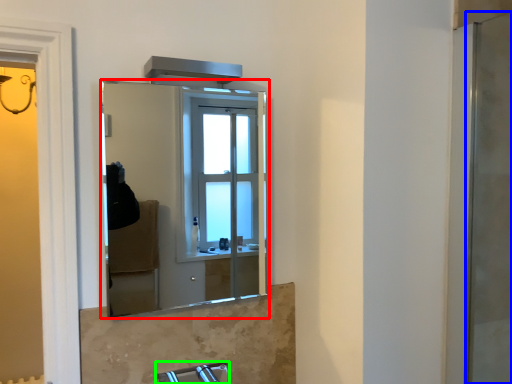
Question: Estimate the real-world distances between objects in this image. Which object is closer to mirror (highlighted by a red box), screen door (highlighted by a blue box) or faucet (highlighted by a green box)?

Choices:
 (A) screen door
 (B) faucet

Answer: (B)